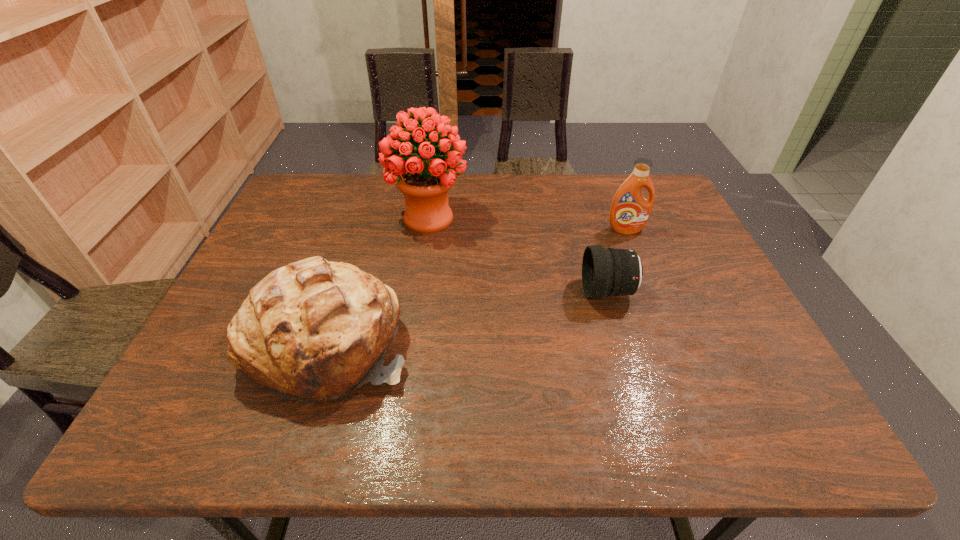
Locate an element on the screen. This screenshot has width=960, height=540. object located at the far edge is located at coordinates (424, 183).

The width and height of the screenshot is (960, 540). Identify the location of object present at the near edge. (x=314, y=330).

The height and width of the screenshot is (540, 960). I want to click on object at the left edge, so click(314, 330).

The image size is (960, 540). I want to click on object located at the right edge, so click(630, 211).

The width and height of the screenshot is (960, 540). Identify the location of object located at the near left corner. (314, 330).

Locate an element on the screen. vacant space at the far edge of the desktop is located at coordinates (493, 200).

I want to click on vacant region at the near edge, so click(x=320, y=428).

You are a GUI agent. You are given a task and a screenshot of the screen. Output one action in this format:
    pyautogui.click(x=<x>, y=<y>)
    Task: Click on the vacant area at the left edge of the desktop
    This screenshot has height=540, width=960.
    Given the screenshot: What is the action you would take?
    pyautogui.click(x=296, y=249)

You are a GUI agent. You are given a task and a screenshot of the screen. Output one action in this format:
    pyautogui.click(x=<x>, y=<y>)
    Task: Click on the free space at the right edge of the desktop
    The height and width of the screenshot is (540, 960).
    Given the screenshot: What is the action you would take?
    pyautogui.click(x=703, y=320)

The height and width of the screenshot is (540, 960). What are the coordinates of `blank space at the far left corner` in the screenshot? It's located at (317, 204).